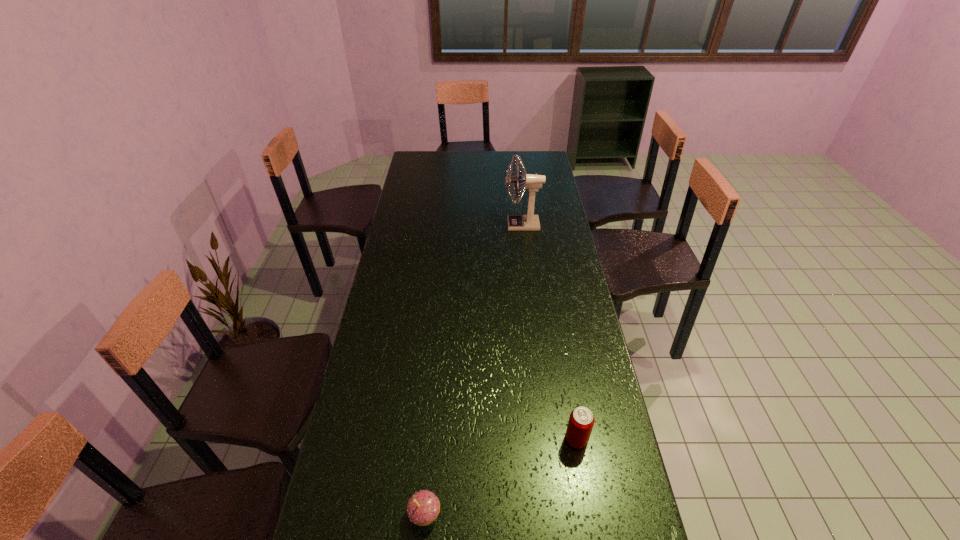
Where is `free point between the farthest object and the second farthest object`? free point between the farthest object and the second farthest object is located at coordinates (549, 332).

Find the location of `vacant point located between the can and the farthest object`. vacant point located between the can and the farthest object is located at coordinates (549, 332).

You are a GUI agent. You are given a task and a screenshot of the screen. Output one action in this format:
    pyautogui.click(x=<x>, y=<y>)
    Task: Click on the unoccupied position between the cupcake and the can
    This screenshot has width=960, height=540.
    Given the screenshot: What is the action you would take?
    pyautogui.click(x=500, y=477)

Identify the location of the second closest object relative to the can. The width and height of the screenshot is (960, 540). (530, 222).

Select which object appears as the second closest to the cupcake. Please provide its 2D coordinates. Your answer should be formatted as a tuple, i.e. [(x, y)], where the tuple contains the x and y coordinates of a point satisfying the conditions above.

[(530, 222)]

I want to click on blank space that satisfies the following two spatial constraints: 1. on the front-facing side of the farthest object; 2. on the right side of the second nearest object, so click(x=548, y=440).

Identify the location of vacant area in the image that satisfies the following two spatial constraints: 1. on the front-facing side of the can; 2. on the left side of the tallest object. The image size is (960, 540). (548, 440).

Locate an element on the screen. This screenshot has width=960, height=540. free point that satisfies the following two spatial constraints: 1. on the front-facing side of the can; 2. on the right side of the tallest object is located at coordinates (548, 440).

This screenshot has width=960, height=540. In order to click on free space that satisfies the following two spatial constraints: 1. on the front-facing side of the tallest object; 2. on the back side of the can in this screenshot , I will do `click(548, 440)`.

Identify the location of vacant point that satisfies the following two spatial constraints: 1. on the front-facing side of the tallest object; 2. on the right side of the second farthest object. Image resolution: width=960 pixels, height=540 pixels. (548, 440).